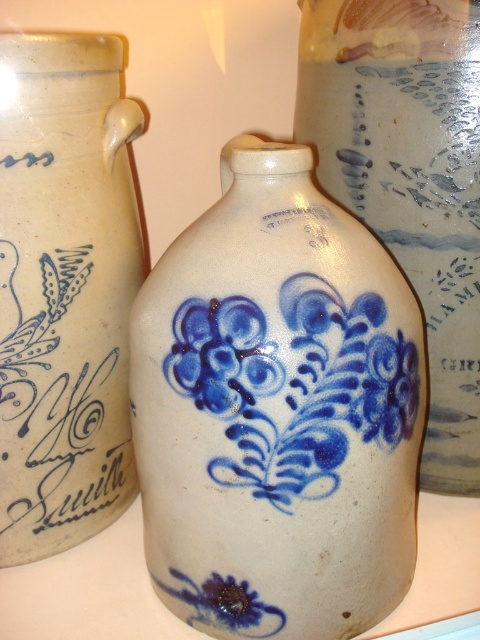
Is the position of white stoneware vase at center less distant than that of blue painted floral design at center?

No, white stoneware vase at center is behind blue painted floral design at center.

Describe the element at coordinates (276, 410) in the screenshot. I see `white stoneware vase at center` at that location.

Is point (321, 230) more distant than point (251, 380)?

Yes, it is.

Find the location of a particular element. Image resolution: width=480 pixels, height=640 pixels. white stoneware vase at center is located at coordinates (276, 410).

Describe the element at coordinates (276, 410) in the screenshot. I see `white stoneware vase at center` at that location.

Which is in front, point (314, 244) or point (369, 116)?

Positioned in front is point (314, 244).

The image size is (480, 640). Describe the element at coordinates (276, 410) in the screenshot. I see `white stoneware vase at center` at that location.

Identify the location of white stoneware vase at center. Image resolution: width=480 pixels, height=640 pixels. (276, 410).

This screenshot has width=480, height=640. What are the coordinates of `matte ceramic vase at left` in the screenshot? It's located at (x=64, y=289).

Is point (113, 477) more distant than point (389, 237)?

Yes, it is.

Where is `matte ceramic vase at left`? This screenshot has height=640, width=480. matte ceramic vase at left is located at coordinates (64, 289).